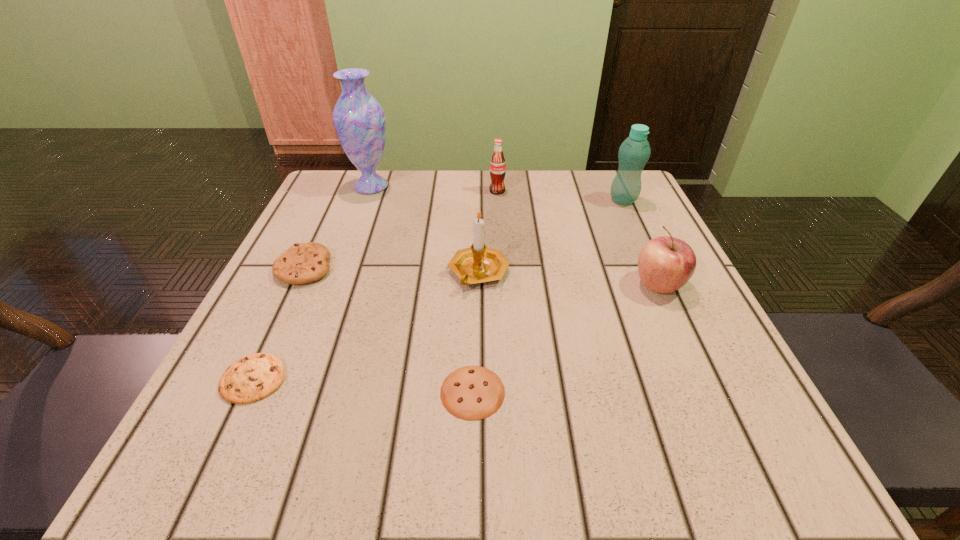
You are a GUI agent. You are given a task and a screenshot of the screen. Output one action in this format:
    pyautogui.click(x=<x>, y=<y>)
    Task: Click on the tallest object
    
    Given the screenshot: What is the action you would take?
    pyautogui.click(x=359, y=120)

In order to click on the seventh shortest object in this screenshot , I will do point(634,152).

Where is `candle holder`? candle holder is located at coordinates (477, 264).

This screenshot has width=960, height=540. I want to click on soda, so click(497, 165).

Locate an element on the screen. The height and width of the screenshot is (540, 960). apple is located at coordinates (665, 264).

The width and height of the screenshot is (960, 540). What are the coordinates of `the third shortest object` in the screenshot? It's located at (302, 263).

Image resolution: width=960 pixels, height=540 pixels. What are the coordinates of `the farthest cookie` in the screenshot? It's located at (302, 263).

The height and width of the screenshot is (540, 960). I want to click on the seventh tallest object, so click(x=254, y=377).

Identify the location of the shortest object. (472, 392).

Image resolution: width=960 pixels, height=540 pixels. Identify the location of the shortest cookie. (472, 392).